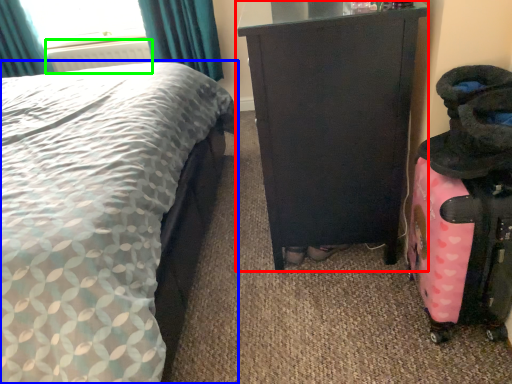
Question: Based on their relative distances, which object is farther from furniture (highlighted by a red box)? Choose from bed (highlighted by a blue box) and radiator (highlighted by a green box).

Choices:
 (A) bed
 (B) radiator

Answer: (B)